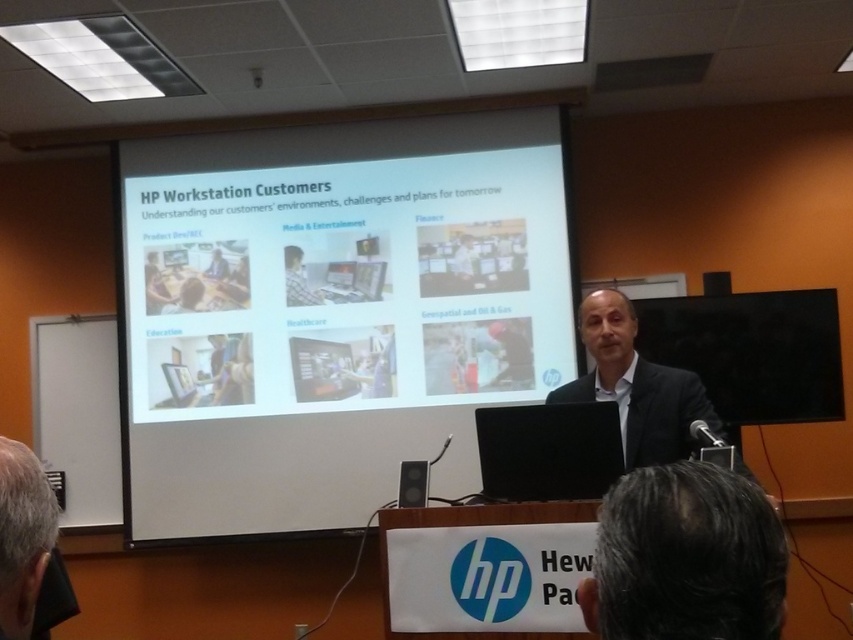
What do you see at coordinates (22, 536) in the screenshot? I see `gray hair at lower left` at bounding box center [22, 536].

Can you confirm if gray hair at lower left is positioned to the right of matte black laptop at center?

Correct, you'll find gray hair at lower left to the right of matte black laptop at center.

Locate an element on the screen. gray hair at lower left is located at coordinates (22, 536).

This screenshot has width=853, height=640. I want to click on gray hair at lower left, so click(x=22, y=536).

Between white matte projector screen at upper center and matte black laptop at upper center, which one appears on the left side from the viewer's perspective?

matte black laptop at upper center

Image resolution: width=853 pixels, height=640 pixels. I want to click on white matte projector screen at upper center, so click(x=332, y=312).

This screenshot has height=640, width=853. In order to click on white matte projector screen at upper center in this screenshot , I will do `click(332, 312)`.

Can you confirm if gray hair at lower left is wider than matte black laptop at upper center?

No.

Is gray hair at lower left above matte black laptop at upper center?

No.

The width and height of the screenshot is (853, 640). What do you see at coordinates (22, 536) in the screenshot?
I see `gray hair at lower left` at bounding box center [22, 536].

The height and width of the screenshot is (640, 853). I want to click on gray hair at lower left, so click(22, 536).